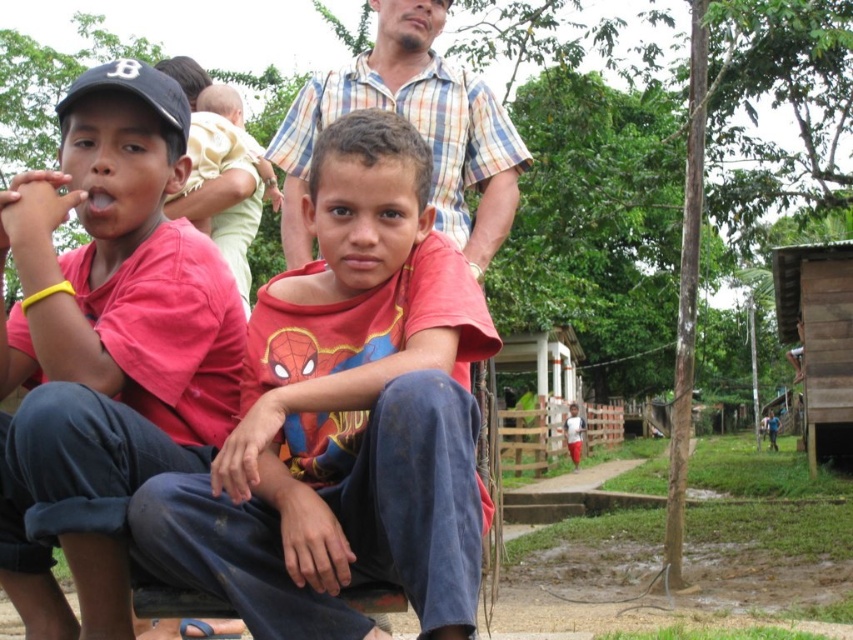
Is matte red shirt at left closer to the viewer compared to plaid cotton shirt at upper center?

Yes.

Who is higher up, matte red shirt at left or plaid cotton shirt at upper center?

plaid cotton shirt at upper center is above.

This screenshot has width=853, height=640. What do you see at coordinates (106, 348) in the screenshot?
I see `matte red shirt at left` at bounding box center [106, 348].

Identify the location of matte red shirt at left. (106, 348).

This screenshot has height=640, width=853. What do you see at coordinates (345, 417) in the screenshot?
I see `matte red shirt at center` at bounding box center [345, 417].

Locate an element on the screen. This screenshot has width=853, height=640. matte red shirt at center is located at coordinates (345, 417).

Is point (360, 636) farther from camera compared to point (425, 12)?

No, (360, 636) is in front of (425, 12).

Locate an element on the screen. Image resolution: width=853 pixels, height=640 pixels. matte red shirt at center is located at coordinates [345, 417].

How distant is matte red shirt at center from matte red shirt at left?

matte red shirt at center and matte red shirt at left are 24.82 inches apart.

You are a GUI agent. You are given a task and a screenshot of the screen. Output one action in this format:
    pyautogui.click(x=<x>, y=<y>)
    Task: Click on the matte red shirt at center
    
    Given the screenshot: What is the action you would take?
    pyautogui.click(x=345, y=417)

The height and width of the screenshot is (640, 853). Find the location of `matte red shirt at center`. matte red shirt at center is located at coordinates (345, 417).